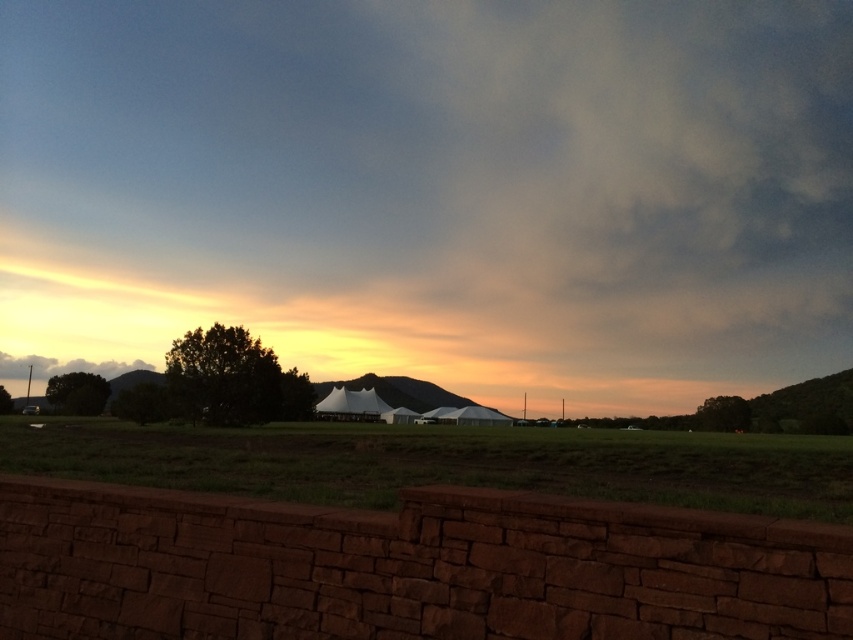
You are standing in front of the low stone wall at the bottom of the image. You want to walk towards the green grass at center. Is the white fabric tent at center blocking your path?

The green grass at center is behind the white fabric tent at center, so the tent is blocking your path to the grass.

You are a hiker who has just arrived at this serene outdoor location. You see the white fabric tent at center and the green grass at center. Which object is higher in elevation?

The white fabric tent at center is above the green grass at center, so it is higher in elevation.